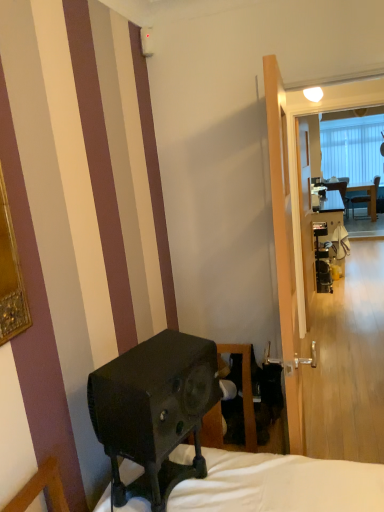
Question: Is transparent glass screen door at center, the second screen door in the right-to-left sequence, facing towards clear glass screen door at center, which appears as the first screen door when viewed from the back?

Choices:
 (A) yes
 (B) no

Answer: (B)

Question: Can you confirm if transparent glass screen door at center, which is counted as the first screen door, starting from the left, is smaller than clear glass screen door at center, which appears as the first screen door when viewed from the back?

Choices:
 (A) no
 (B) yes

Answer: (A)

Question: Does transparent glass screen door at center, positioned as the second screen door in back-to-front order, appear on the left side of clear glass screen door at center, which appears as the first screen door when viewed from the back?

Choices:
 (A) no
 (B) yes

Answer: (B)

Question: Considering the relative sizes of transparent glass screen door at center, which is counted as the first screen door, starting from the left, and clear glass screen door at center, acting as the 1th screen door starting from the right, in the image provided, is transparent glass screen door at center, which is counted as the first screen door, starting from the left, shorter than clear glass screen door at center, acting as the 1th screen door starting from the right,?

Choices:
 (A) no
 (B) yes

Answer: (B)

Question: Considering the relative sizes of transparent glass screen door at center, positioned as the second screen door in back-to-front order, and clear glass screen door at center, acting as the 1th screen door starting from the right, in the image provided, is transparent glass screen door at center, positioned as the second screen door in back-to-front order, taller than clear glass screen door at center, acting as the 1th screen door starting from the right,?

Choices:
 (A) yes
 (B) no

Answer: (B)

Question: Considering their positions, is transparent glass screen door at center, which is the first screen door from front to back, located in front of or behind black matte speaker at lower left?

Choices:
 (A) behind
 (B) front

Answer: (A)

Question: Looking at the image, does transparent glass screen door at center, which is counted as the first screen door, starting from the left, seem bigger or smaller compared to black matte speaker at lower left?

Choices:
 (A) small
 (B) big

Answer: (B)

Question: From a real-world perspective, is transparent glass screen door at center, which is the first screen door from front to back, above or below black matte speaker at lower left?

Choices:
 (A) below
 (B) above

Answer: (B)

Question: From the image's perspective, is transparent glass screen door at center, which is counted as the first screen door, starting from the left, located above or below black matte speaker at lower left?

Choices:
 (A) above
 (B) below

Answer: (A)

Question: From the image's perspective, relative to matte black desk at center, is clear glass screen door at center, acting as the 1th screen door starting from the right, above or below?

Choices:
 (A) below
 (B) above

Answer: (B)

Question: Does point (312, 267) appear closer or farther from the camera than point (347, 249)?

Choices:
 (A) closer
 (B) farther

Answer: (A)

Question: Is clear glass screen door at center, which appears as the first screen door when viewed from the back, to the left or to the right of matte black desk at center in the image?

Choices:
 (A) right
 (B) left

Answer: (B)

Question: From their relative heights in the image, would you say clear glass screen door at center, which ranks as the 2th screen door in left-to-right order, is taller or shorter than matte black desk at center?

Choices:
 (A) short
 (B) tall

Answer: (B)

Question: Do you think matte black desk at center is within clear glass screen door at center, positioned as the 2th screen door in front-to-back order, or outside of it?

Choices:
 (A) outside
 (B) inside

Answer: (A)

Question: Based on their sizes in the image, would you say matte black desk at center is bigger or smaller than clear glass screen door at center, which ranks as the 2th screen door in left-to-right order?

Choices:
 (A) small
 (B) big

Answer: (B)